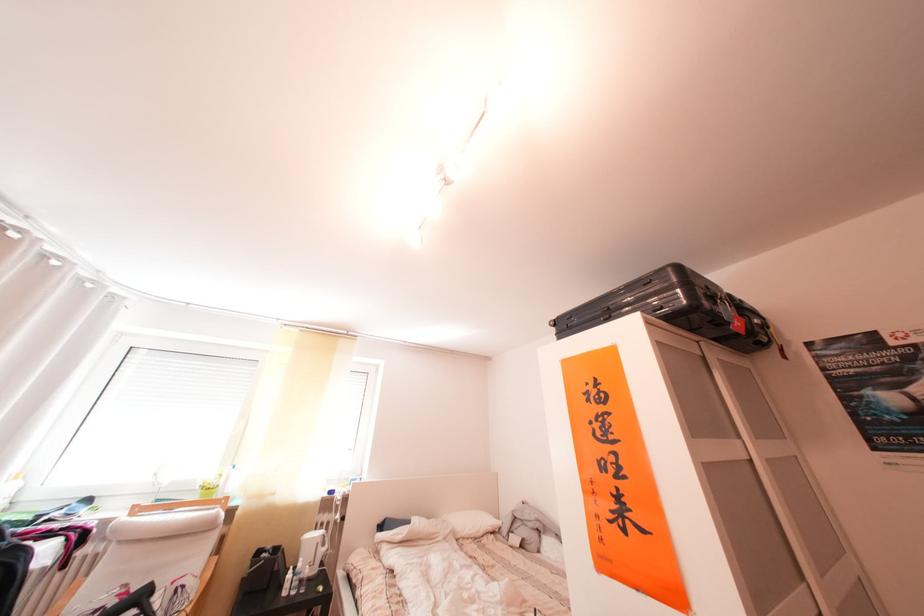
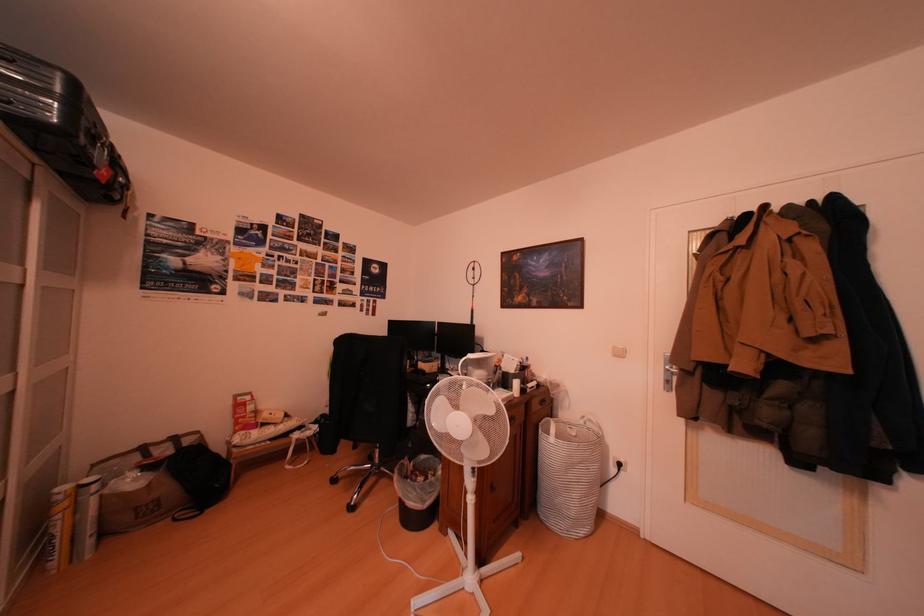
The point at (675,313) is marked in the first image. Where is the corresponding point in the second image?

(19, 108)